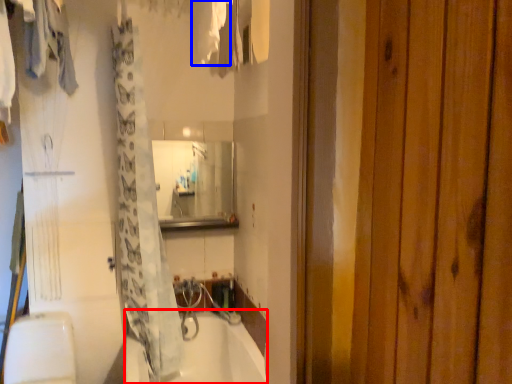
Question: Which object is closer to the camera taking this photo, bathtub (highlighted by a red box) or clothing (highlighted by a blue box)?

Choices:
 (A) bathtub
 (B) clothing

Answer: (B)